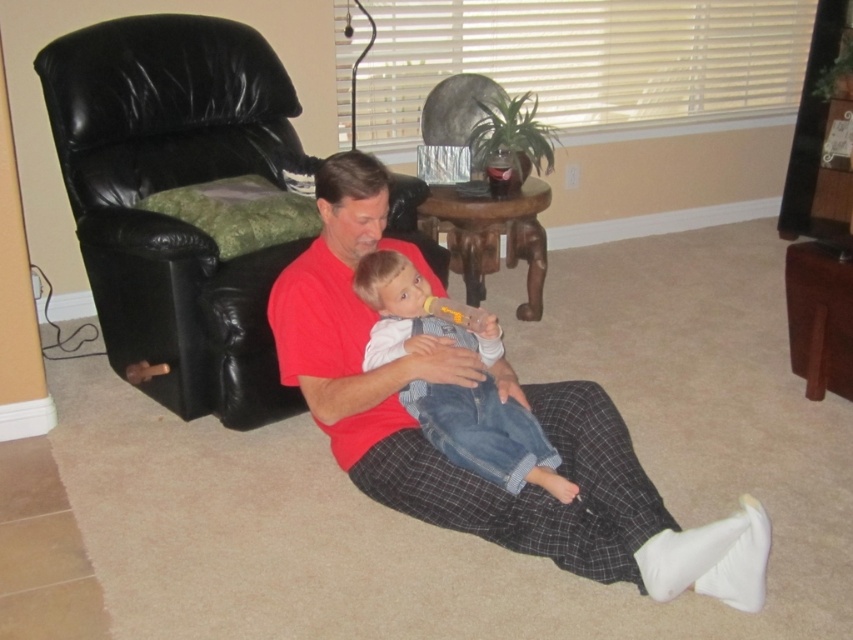
Is point (714, 545) in front of point (404, 314)?

Yes, it is.

Does red cotton shirt at center come behind denim overalls at center?

No, it is not.

Does point (358, 252) come in front of point (476, 440)?

That is False.

What are the coordinates of `red cotton shirt at center` in the screenshot? It's located at (498, 406).

From the picture: Is the position of black leather armchair at left less distant than that of denim overalls at center?

No, black leather armchair at left is behind denim overalls at center.

Who is more distant from viewer, [120,188] or [381,358]?

The point [120,188] is more distant.

I want to click on black leather armchair at left, so click(x=170, y=188).

Locate an element on the screen. This screenshot has height=640, width=853. black leather armchair at left is located at coordinates (170, 188).

Can you confirm if red cotton shirt at center is positioned below black leather armchair at left?

Indeed, red cotton shirt at center is positioned under black leather armchair at left.

Can you confirm if red cotton shirt at center is positioned to the right of black leather armchair at left?

Indeed, red cotton shirt at center is positioned on the right side of black leather armchair at left.

Find the location of a particular element. This screenshot has width=853, height=640. red cotton shirt at center is located at coordinates pyautogui.click(x=498, y=406).

Image resolution: width=853 pixels, height=640 pixels. Find the location of `red cotton shirt at center`. red cotton shirt at center is located at coordinates coord(498,406).